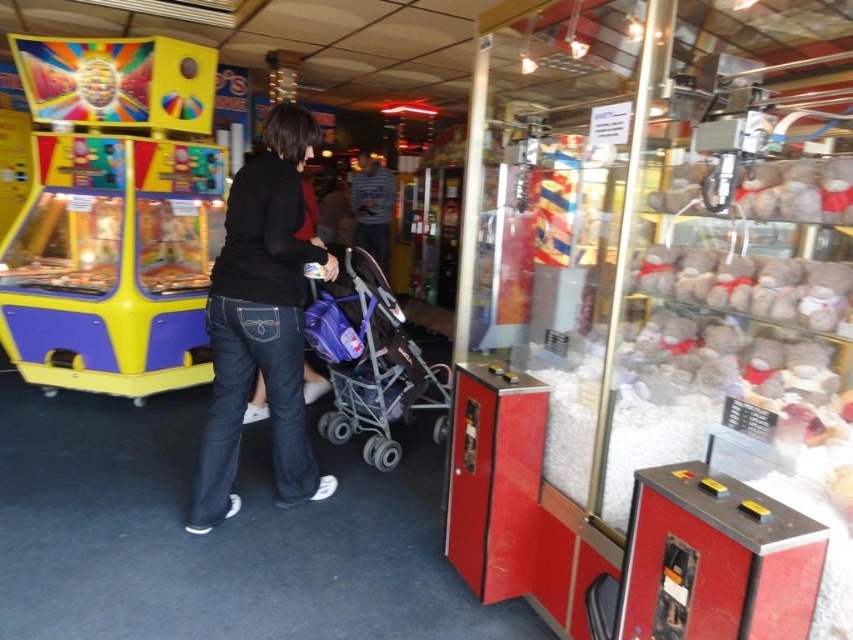
Question: Estimate the real-world distances between objects in this image. Which object is closer to the purple fabric baby carriage at center?

Choices:
 (A) black denim jeans at center
 (B) shiny plastic claw machine at left

Answer: (A)

Question: Which object is positioned farthest from the striped shirt at center?

Choices:
 (A) black denim jeans at center
 (B) shiny plastic claw machine at left
 (C) purple fabric baby carriage at center

Answer: (A)

Question: In this image, where is shiny plastic claw machine at left located relative to purple fabric baby carriage at center?

Choices:
 (A) above
 (B) below

Answer: (A)

Question: Does black denim jeans at center appear on the left side of purple fabric baby carriage at center?

Choices:
 (A) no
 (B) yes

Answer: (B)

Question: Which of these objects is positioned closest to the shiny plastic claw machine at left?

Choices:
 (A) black denim jeans at center
 (B) striped shirt at center

Answer: (A)

Question: Does shiny plastic claw machine at left appear over purple fabric baby carriage at center?

Choices:
 (A) yes
 (B) no

Answer: (A)